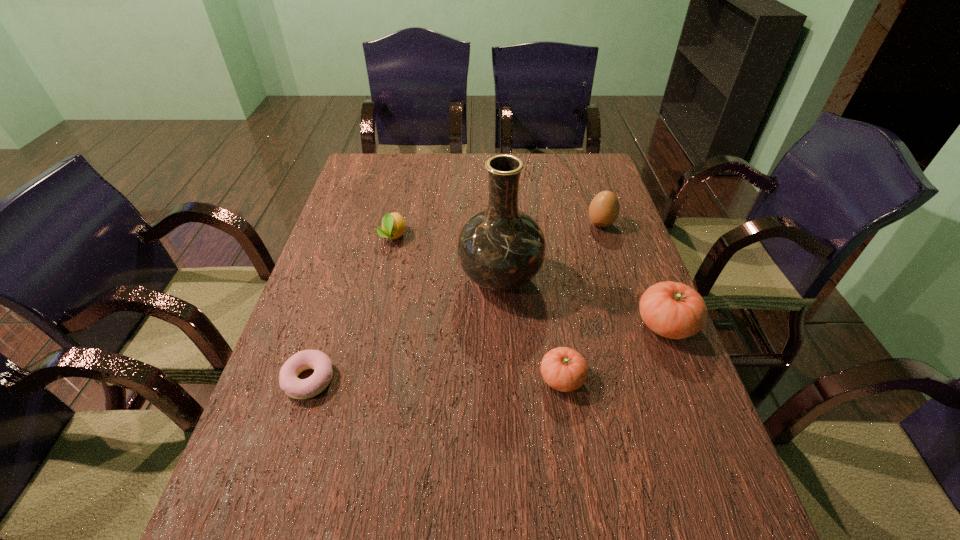
Where is `the nearer tomato`? The width and height of the screenshot is (960, 540). the nearer tomato is located at coordinates (564, 369).

Locate an element on the screen. The image size is (960, 540). the left tomato is located at coordinates (564, 369).

This screenshot has width=960, height=540. What are the coordinates of `the farther tomato` in the screenshot? It's located at click(674, 310).

Where is `the right tomato`? the right tomato is located at coordinates (674, 310).

I want to click on the second object from left to right, so click(393, 224).

Find the location of a particular element. boiled egg is located at coordinates (604, 209).

Locate an element on the screen. the shortest object is located at coordinates (296, 388).

Locate an element on the screen. Image resolution: width=960 pixels, height=540 pixels. the leftmost object is located at coordinates (296, 388).

The image size is (960, 540). I want to click on vase, so click(x=501, y=248).

I want to click on free spot located 0.170m on the back of the nearer tomato, so click(x=550, y=305).